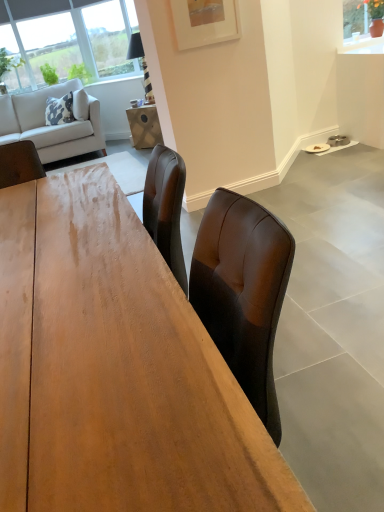
Question: Is wooden table at center inside or outside of white glossy counter top at upper right?

Choices:
 (A) outside
 (B) inside

Answer: (A)

Question: In terms of height, does wooden table at center look taller or shorter compared to white glossy counter top at upper right?

Choices:
 (A) tall
 (B) short

Answer: (A)

Question: Based on their relative distances, which object is farther from the light gray fabric couch at upper left?

Choices:
 (A) white matte picture frame at upper center
 (B) white glossy counter top at upper right
 (C) white matte plate at lower right
 (D) wooden table at center

Answer: (D)

Question: Which object is positioned closest to the light gray fabric couch at upper left?

Choices:
 (A) white matte picture frame at upper center
 (B) white matte plate at lower right
 (C) white glossy counter top at upper right
 (D) wooden table at center

Answer: (A)